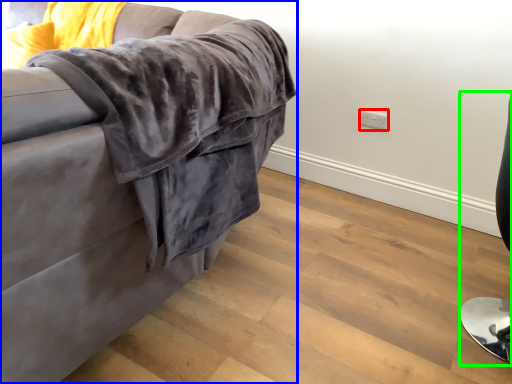
Question: Based on their relative distances, which object is nearer to electric outlet (highlighted by a red box)? Choose from studio couch (highlighted by a blue box) and computer chair (highlighted by a green box).

Choices:
 (A) studio couch
 (B) computer chair

Answer: (B)